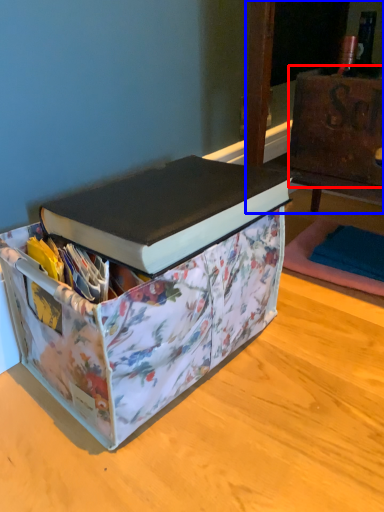
Question: Which of the following is the closest to the observer, cardboard box (highlighted by a red box) or furniture (highlighted by a blue box)?

Choices:
 (A) cardboard box
 (B) furniture

Answer: (B)